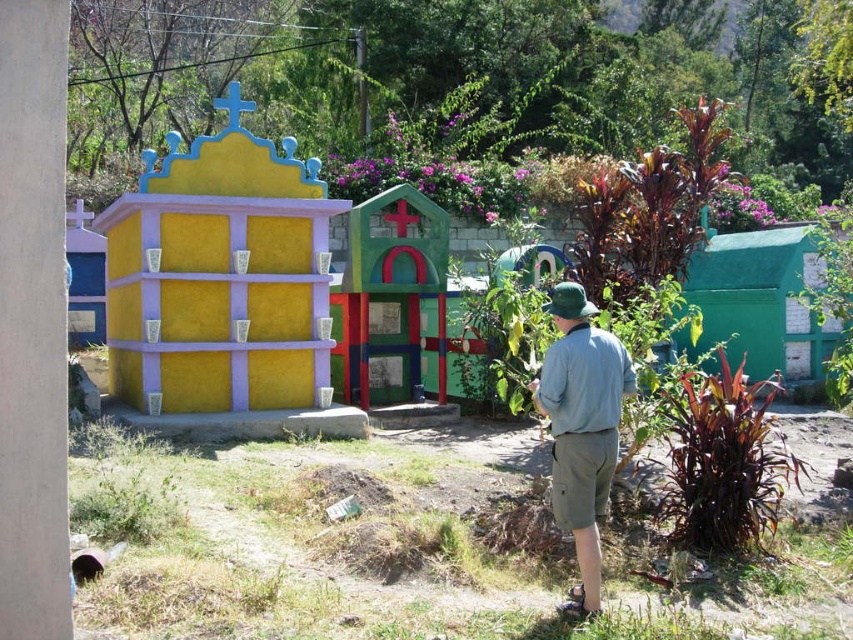
You are a visitor standing at the entrance of the cemetery and want to take a photo of both the multicolored painted wooden house at center and the green cotton shirt at center. Which object should you focus on first if you want to include both in the frame without moving the camera?

The multicolored painted wooden house at center is taller than the green cotton shirt at center, so you should focus on the multicolored painted wooden house at center first to ensure both are in frame.

What are the coordinates of the multicolored painted wooden house at center?

The multicolored painted wooden house at center is located at coordinates point [392,298].

You are standing at the entrance of the cemetery and see the multicolored painted wooden house at center and the green cotton shirt at center. Which object is closer to you?

The green cotton shirt at center is closer to you because the multicolored painted wooden house at center is 6.51 meters away from it, meaning the shirt is nearer than the house.